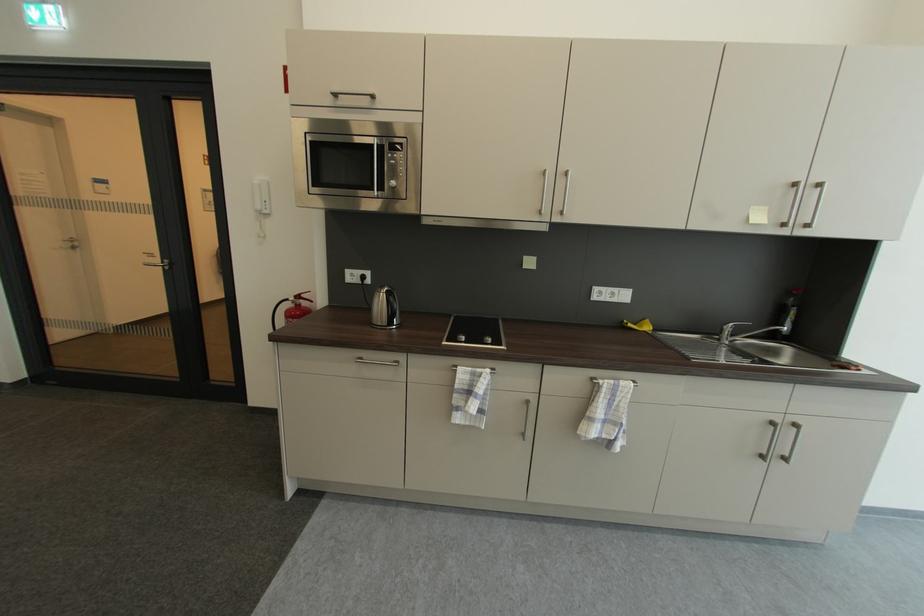
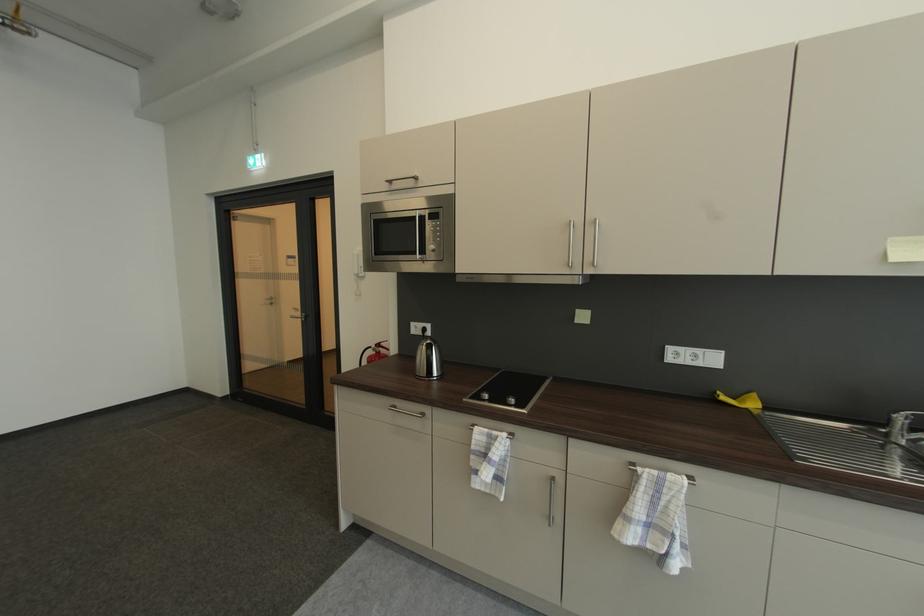
Question: The camera is either moving clockwise (left) or counter-clockwise (right) around the object. The first image is from the beginning of the video and the second image is from the end. Is the camera moving left or right when shooting the video?

Choices:
 (A) Left
 (B) Right

Answer: (B)